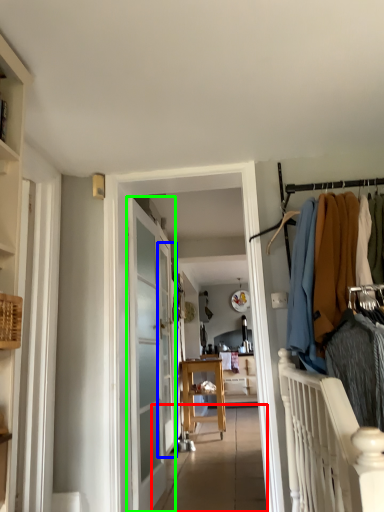
Question: Which object is the closest to the path (highlighted by a red box)? Choose among these: screen door (highlighted by a blue box) or door (highlighted by a green box).

Choices:
 (A) screen door
 (B) door

Answer: (A)